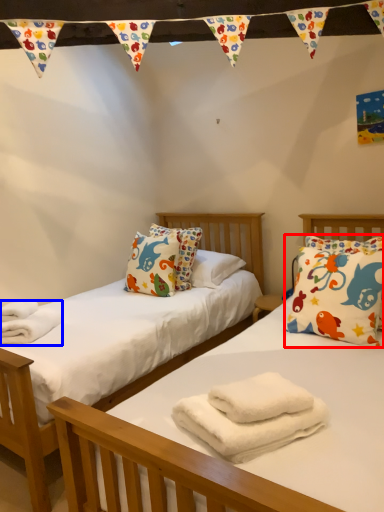
Question: Which object appears closest to the camera in this image, pillow (highlighted by a red box) or material (highlighted by a blue box)?

Choices:
 (A) pillow
 (B) material

Answer: (A)